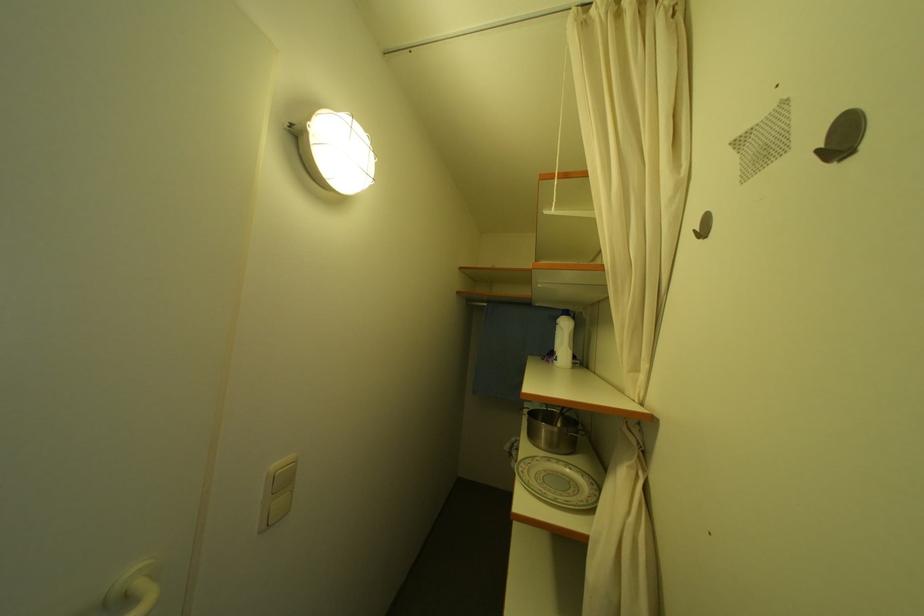
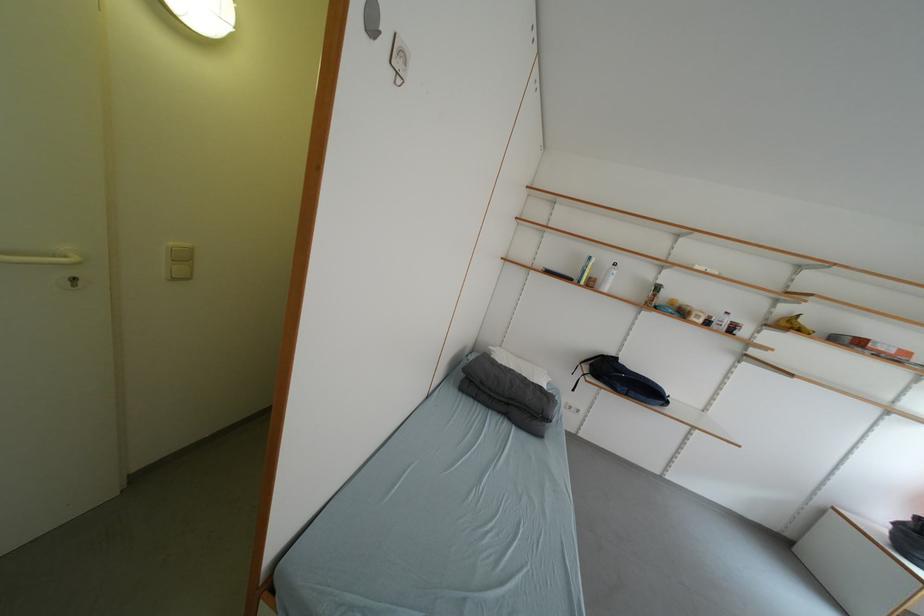
The point at [292,485] is marked in the first image. Where is the corresponding point in the second image?

(191, 261)